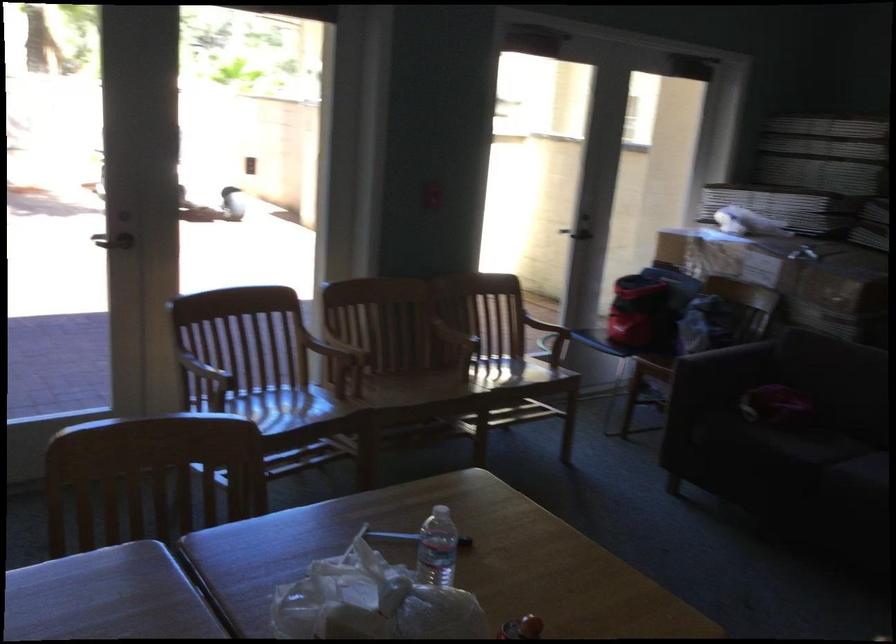
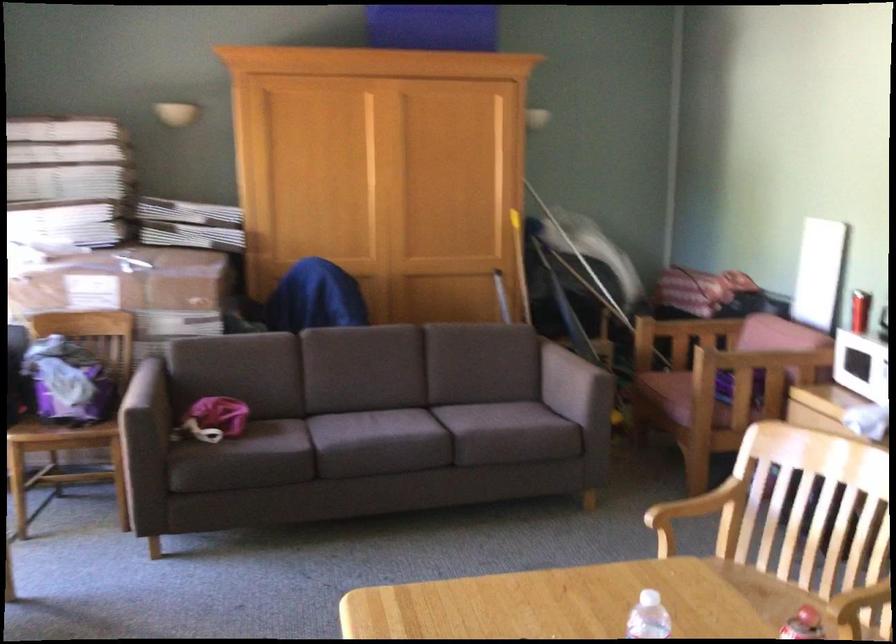
Where in the second image is the point corresponding to [810,265] from the first image?

(131, 290)